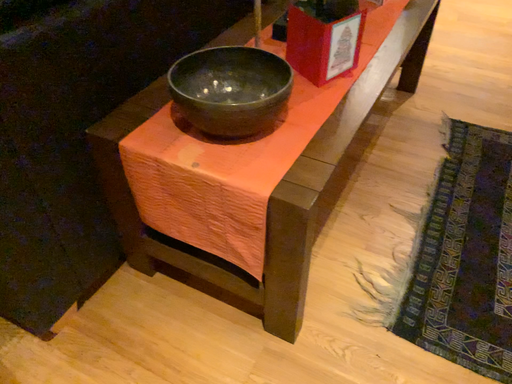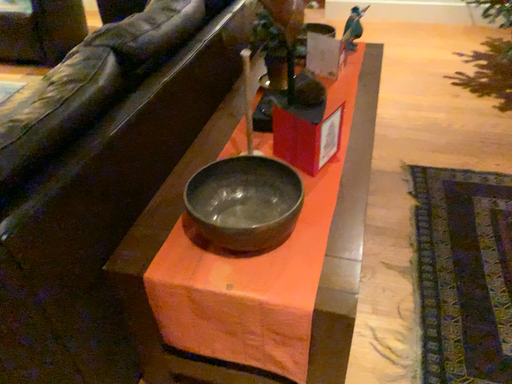
Question: Which way did the camera rotate in the video?

Choices:
 (A) rotated right
 (B) rotated left

Answer: (A)